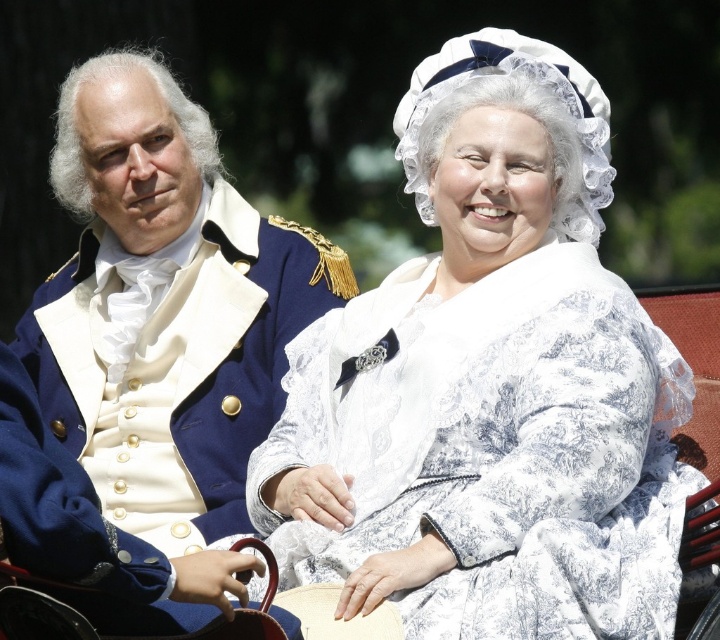
Question: Which of the following is the farthest from the observer?

Choices:
 (A) blue wool coat at left
 (B) white lace dress at center

Answer: (B)

Question: Among these objects, which one is nearest to the camera?

Choices:
 (A) blue wool coat at left
 (B) white lace dress at center

Answer: (A)

Question: Can you confirm if white lace dress at center is positioned to the left of blue wool coat at left?

Choices:
 (A) yes
 (B) no

Answer: (B)

Question: Considering the relative positions of white lace dress at center and blue wool coat at left in the image provided, where is white lace dress at center located with respect to blue wool coat at left?

Choices:
 (A) left
 (B) right

Answer: (B)

Question: Is white lace dress at center above blue wool coat at left?

Choices:
 (A) no
 (B) yes

Answer: (A)